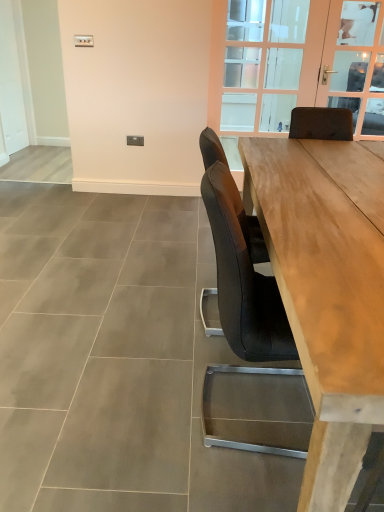
Find the location of a particular element. The image size is (384, 512). white matte door at left is located at coordinates (12, 78).

This screenshot has width=384, height=512. Describe the element at coordinates (308, 62) in the screenshot. I see `clear glass door at upper center` at that location.

At what (x,y) coordinates should I click in order to perform the action: click on clear glass door at upper right. Please return your answer as a coordinate pair (x, y). The image size is (384, 512). Looking at the image, I should click on (355, 64).

From the image's perspective, who appears lower, white matte door at left or clear glass door at upper center?

clear glass door at upper center.

Do you think white matte door at left is within clear glass door at upper center, or outside of it?

white matte door at left is not enclosed by clear glass door at upper center.

Which object is further away from the camera taking this photo, white matte door at left or clear glass door at upper center?

white matte door at left is further away from the camera.

Considering the sizes of objects white matte door at left and clear glass door at upper center in the image provided, who is smaller, white matte door at left or clear glass door at upper center?

white matte door at left is smaller.

From the picture: Considering the relative sizes of clear glass door at upper right and natural wood table at center in the image provided, is clear glass door at upper right smaller than natural wood table at center?

Correct, clear glass door at upper right occupies less space than natural wood table at center.

From a real-world perspective, does clear glass door at upper right stand above natural wood table at center?

Yes, from a real-world perspective, clear glass door at upper right is over natural wood table at center

Which of these two, clear glass door at upper right or natural wood table at center, is thinner?

With smaller width is clear glass door at upper right.

Which object is wider, clear glass door at upper right or white matte door at left?

With larger width is white matte door at left.

At what (x,y) coordinates should I click in order to perform the action: click on window screen that is on the right side of white matte door at left. Please return your answer as a coordinate pair (x, y). This screenshot has width=384, height=512. Looking at the image, I should click on (355, 64).

Does clear glass door at upper right have a larger size compared to white matte door at left?

No, clear glass door at upper right is not bigger than white matte door at left.

Is white matte door at left facing towards natural wood table at center?

No, white matte door at left is not turned towards natural wood table at center.

Is white matte door at left at the right side of natural wood table at center?

No.

Does white matte door at left lie in front of natural wood table at center?

No, white matte door at left is behind natural wood table at center.

Does clear glass door at upper center have a greater height compared to white matte door at left?

Yes, clear glass door at upper center is taller than white matte door at left.

Where is `window in front of the white matte door at left`? Image resolution: width=384 pixels, height=512 pixels. window in front of the white matte door at left is located at coordinates (308, 62).

In the scene shown: Between clear glass door at upper center and white matte door at left, which one has larger width?

clear glass door at upper center.

In the image, is clear glass door at upper center positioned in front of or behind white matte door at left?

In the image, clear glass door at upper center appears in front of white matte door at left.

Considering the positions of points (256, 131) and (368, 32), is point (256, 131) farther from camera compared to point (368, 32)?

Yes, point (256, 131) is farther from viewer.

Considering the sizes of clear glass door at upper center and clear glass door at upper right in the image, is clear glass door at upper center wider or thinner than clear glass door at upper right?

Clearly, clear glass door at upper center has more width compared to clear glass door at upper right.

From a real-world perspective, which object stands above the other?

clear glass door at upper right is physically above.

Is clear glass door at upper center oriented away from clear glass door at upper right?

Yes, clear glass door at upper center's orientation is away from clear glass door at upper right.

Considering the relative sizes of clear glass door at upper right and clear glass door at upper center in the image provided, is clear glass door at upper right wider than clear glass door at upper center?

Result: Incorrect, the width of clear glass door at upper right does not surpass that of clear glass door at upper center.

Is clear glass door at upper right oriented away from clear glass door at upper center?

Absolutely, clear glass door at upper right is directed away from clear glass door at upper center.

From a real-world perspective, who is located lower, clear glass door at upper right or clear glass door at upper center?

clear glass door at upper center.

Is clear glass door at upper right bigger than clear glass door at upper center?

Incorrect, clear glass door at upper right is not larger than clear glass door at upper center.

This screenshot has width=384, height=512. What are the coordinates of `screen door that appears behind the clear glass door at upper center` in the screenshot? It's located at (12, 78).

Locate an element on the screen. table below the clear glass door at upper right (from the image's perspective) is located at coordinates (327, 291).

From the image, which object appears to be farther from white matte door at left, natural wood table at center or clear glass door at upper center?

natural wood table at center is positioned further to the anchor white matte door at left.

Looking at the image, which one is located further to white matte door at left, clear glass door at upper right or clear glass door at upper center?

clear glass door at upper right.

Based on their spatial positions, is white matte door at left or natural wood table at center closer to clear glass door at upper center?

natural wood table at center.

Estimate the real-world distances between objects in this image. Which object is further from natural wood table at center, clear glass door at upper right or clear glass door at upper center?

clear glass door at upper right.

From the image, which object appears to be nearer to clear glass door at upper center, clear glass door at upper right or natural wood table at center?

clear glass door at upper right is positioned closer to the anchor clear glass door at upper center.

Based on their spatial positions, is natural wood table at center or clear glass door at upper center further from clear glass door at upper right?

The object further to clear glass door at upper right is natural wood table at center.

Considering their positions, is natural wood table at center positioned further to clear glass door at upper center than white matte door at left?

white matte door at left is further to clear glass door at upper center.

From the image, which object appears to be nearer to clear glass door at upper right, clear glass door at upper center or natural wood table at center?

Among the two, clear glass door at upper center is located nearer to clear glass door at upper right.

Where is `window between natural wood table at center and white matte door at left along the z-axis`? This screenshot has width=384, height=512. window between natural wood table at center and white matte door at left along the z-axis is located at coordinates (308, 62).

I want to click on window positioned between natural wood table at center and clear glass door at upper right from near to far, so click(x=308, y=62).

Locate an element on the screen. This screenshot has height=512, width=384. table between white matte door at left and clear glass door at upper right is located at coordinates (327, 291).

Locate an element on the screen. Image resolution: width=384 pixels, height=512 pixels. window situated between white matte door at left and clear glass door at upper right from left to right is located at coordinates (308, 62).